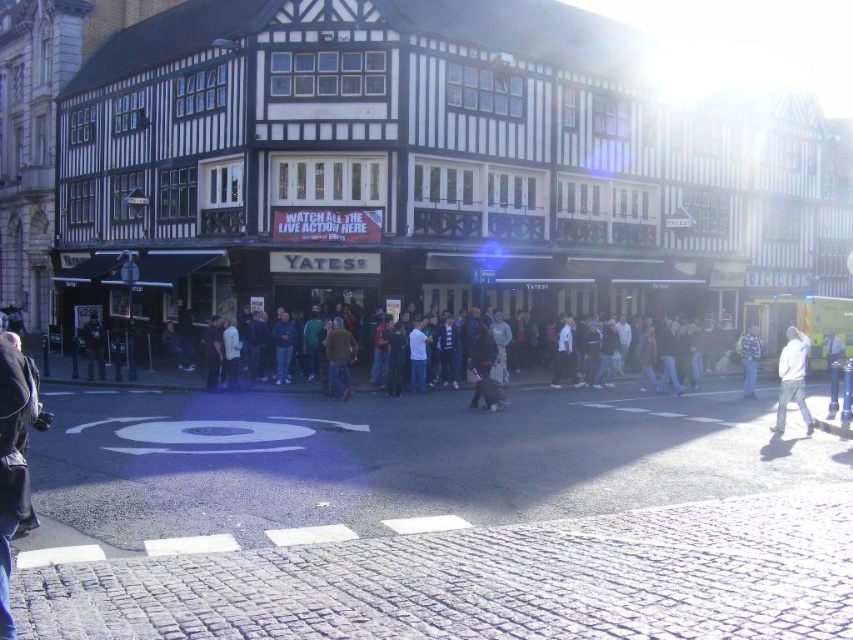
Question: Does brown fabric jacket at center appear over dark blue jeans at lower left?

Choices:
 (A) yes
 (B) no

Answer: (B)

Question: Which of these objects is positioned farthest from the striped jacket at center?

Choices:
 (A) dark clothing crowd at center
 (B) brown fabric jacket at center

Answer: (B)

Question: Does dark blue jeans at lower left have a greater width compared to dark blue jeans at lower right?

Choices:
 (A) no
 (B) yes

Answer: (A)

Question: Can you confirm if dark gray jacket at lower left is positioned above dark blue jeans at lower right?

Choices:
 (A) no
 (B) yes

Answer: (B)

Question: Which object appears closest to the camera in this image?

Choices:
 (A) striped jacket at center
 (B) white matte jacket at lower right
 (C) dark blue jeans at lower left

Answer: (B)

Question: Which of the following is the farthest from the observer?

Choices:
 (A) (805, 348)
 (B) (338, 381)

Answer: (B)